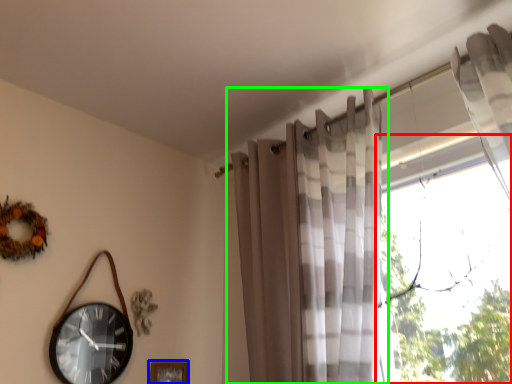
Question: Estimate the real-world distances between objects in this image. Which object is farther from window (highlighted by a red box), picture frame (highlighted by a blue box) or curtain (highlighted by a green box)?

Choices:
 (A) picture frame
 (B) curtain

Answer: (A)